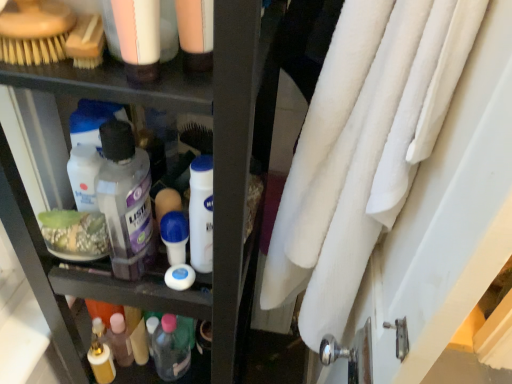
Question: Is matte black shelf at center wider than translucent plastic bottle at lower center, the fourth toiletry positioned from the top?

Choices:
 (A) no
 (B) yes

Answer: (B)

Question: Is matte black shelf at center closer to the viewer compared to translucent plastic bottle at lower center, arranged as the 1th toiletry when ordered from the bottom?

Choices:
 (A) yes
 (B) no

Answer: (A)

Question: Does matte black shelf at center have a greater height compared to translucent plastic bottle at lower center, arranged as the 1th toiletry when ordered from the bottom?

Choices:
 (A) no
 (B) yes

Answer: (B)

Question: Is matte black shelf at center not within translucent plastic bottle at lower center, which is counted as the 1th toiletry, starting from the back?

Choices:
 (A) yes
 (B) no

Answer: (A)

Question: Does matte black shelf at center appear on the right side of translucent plastic bottle at lower center, arranged as the 1th toiletry when ordered from the bottom?

Choices:
 (A) yes
 (B) no

Answer: (B)

Question: In terms of size, does white fluffy towel at right appear bigger or smaller than matte plastic lotion at upper left, the first toiletry in the front-to-back sequence?

Choices:
 (A) big
 (B) small

Answer: (A)

Question: Is white fluffy towel at right inside the boundaries of matte plastic lotion at upper left, which appears as the first toiletry when viewed from the top, or outside?

Choices:
 (A) outside
 (B) inside

Answer: (A)

Question: Considering the positions of white fluffy towel at right and matte plastic lotion at upper left, positioned as the 4th toiletry in bottom-to-top order, in the image, is white fluffy towel at right taller or shorter than matte plastic lotion at upper left, positioned as the 4th toiletry in bottom-to-top order,?

Choices:
 (A) tall
 (B) short

Answer: (A)

Question: From a real-world perspective, is white fluffy towel at right positioned above or below matte plastic lotion at upper left, positioned as the 4th toiletry in bottom-to-top order?

Choices:
 (A) below
 (B) above

Answer: (A)

Question: Is matte black shelf at center inside or outside of matte plastic lotion at upper left, which appears as the first toiletry when viewed from the top?

Choices:
 (A) outside
 (B) inside

Answer: (A)

Question: In terms of width, does matte black shelf at center look wider or thinner when compared to matte plastic lotion at upper left, the first toiletry in the front-to-back sequence?

Choices:
 (A) wide
 (B) thin

Answer: (A)

Question: Based on their sizes in the image, would you say matte black shelf at center is bigger or smaller than matte plastic lotion at upper left, positioned as the 4th toiletry in bottom-to-top order?

Choices:
 (A) big
 (B) small

Answer: (A)

Question: From the image's perspective, is matte black shelf at center located above or below matte plastic lotion at upper left, the first toiletry in the front-to-back sequence?

Choices:
 (A) above
 (B) below

Answer: (B)

Question: In the image, is translucent plastic bottle at lower center, which is counted as the 1th toiletry, starting from the back, positioned in front of or behind matte plastic lotion at upper left, which appears as the first toiletry when viewed from the top?

Choices:
 (A) behind
 (B) front

Answer: (A)

Question: Is translucent plastic bottle at lower center, the fourth toiletry positioned from the top, taller or shorter than matte plastic lotion at upper left, the fourth toiletry positioned from the back?

Choices:
 (A) tall
 (B) short

Answer: (A)